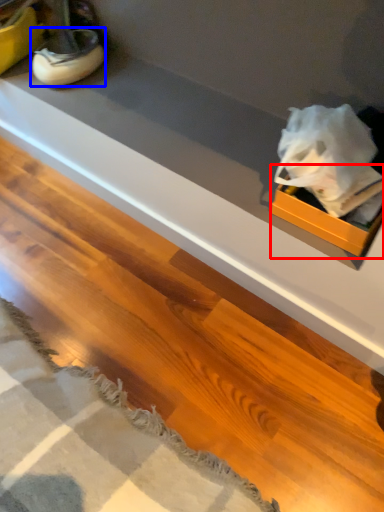
Question: Which object appears farthest to the camera in this image, box (highlighted by a red box) or footwear (highlighted by a blue box)?

Choices:
 (A) box
 (B) footwear

Answer: (B)